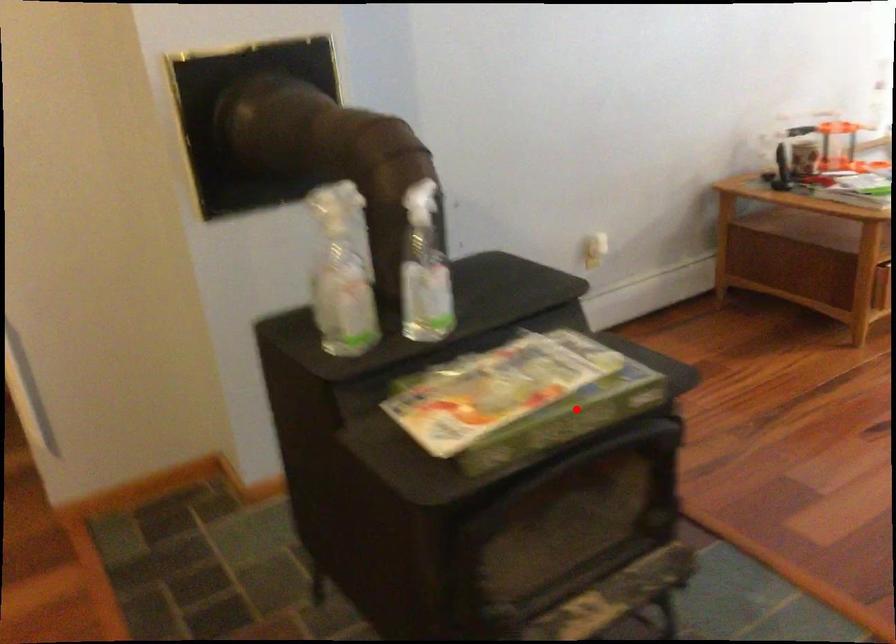
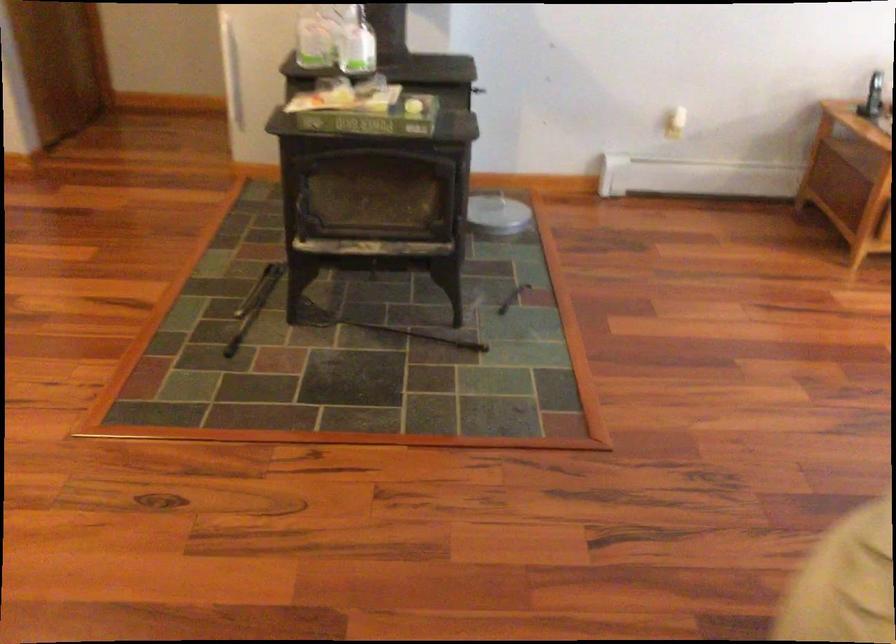
Locate, in the second image, the point that corresponds to the highlighted location in the first image.

(366, 116)